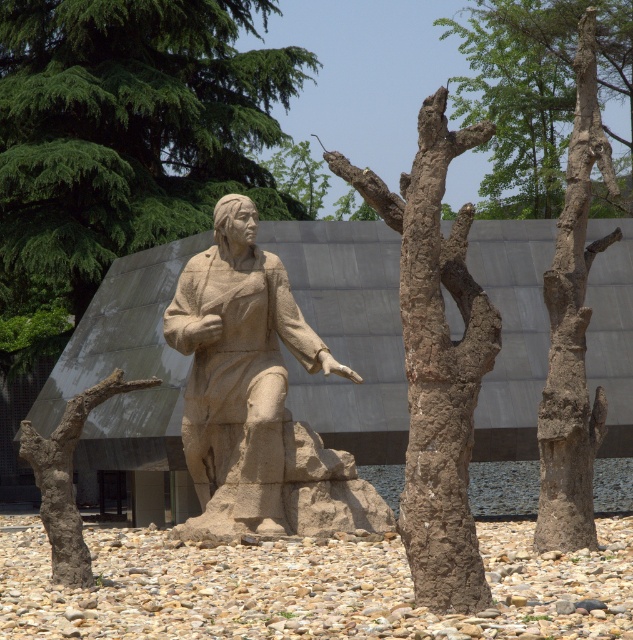
Measure the distance between point (513, 74) and camera.

Point (513, 74) and camera are 70.76 meters apart.

Is brown rough bark tree at upper right taller than green leafy tree at upper center?

Correct, brown rough bark tree at upper right is much taller as green leafy tree at upper center.

Is point (522, 189) behind point (323, 173)?

That is False.

What are the coordinates of `brown rough bark tree at upper right` in the screenshot? It's located at coord(518,97).

Can you confirm if green textured tree at upper left is taller than brown rough bark tree at upper right?

In fact, green textured tree at upper left may be shorter than brown rough bark tree at upper right.

Can you confirm if green textured tree at upper left is thinner than brown rough bark tree at upper right?

No.

Does point (37, 104) lie in front of point (551, 100)?

That is True.

You are a GUI agent. You are given a task and a screenshot of the screen. Output one action in this format:
    pyautogui.click(x=<x>, y=<y>)
    Task: Click on the green textured tree at upper left
    This screenshot has width=633, height=640.
    Given the screenshot: What is the action you would take?
    pos(127,132)

In the scene shown: Can you confirm if brown rough bark at right is positioned to the left of green leafy tree at upper center?

In fact, brown rough bark at right is to the right of green leafy tree at upper center.

How much distance is there between brown rough bark at right and green leafy tree at upper center?

24.16 meters

Measure the distance between brown rough bark at right and camera.

brown rough bark at right and camera are 24.90 meters apart.

At what (x,y) coordinates should I click in order to perform the action: click on brown rough bark at right. Please return your answer as a coordinate pair (x, y). Looking at the image, I should click on (572, 328).